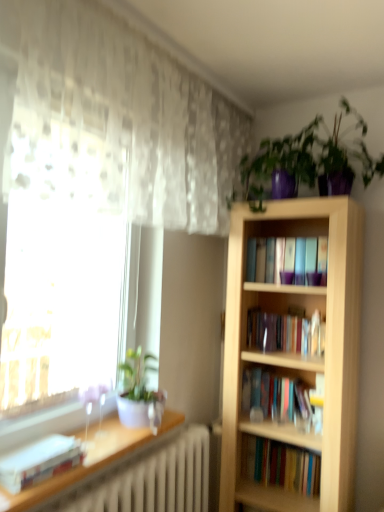
Question: Is shiny purple pot at upper right, the first houseplant viewed from the top, closer to the viewer compared to white glossy pot at left, marked as the 2th houseplant in a right-to-left arrangement?

Choices:
 (A) yes
 (B) no

Answer: (A)

Question: From the image's perspective, is shiny purple pot at upper right, marked as the 1th houseplant in a right-to-left arrangement, located beneath white glossy pot at left, marked as the 1th houseplant in a bottom-to-top arrangement?

Choices:
 (A) yes
 (B) no

Answer: (B)

Question: Is shiny purple pot at upper right, the second houseplant positioned from the left, facing away from white glossy pot at left, marked as the 2th houseplant in a top-to-bottom arrangement?

Choices:
 (A) no
 (B) yes

Answer: (A)

Question: From the image's perspective, is shiny purple pot at upper right, which is counted as the 2th houseplant, starting from the bottom, on white glossy pot at left, marked as the 1th houseplant in a bottom-to-top arrangement?

Choices:
 (A) no
 (B) yes

Answer: (B)

Question: Is shiny purple pot at upper right, the second houseplant positioned from the left, further to the viewer compared to white glossy pot at left, marked as the 2th houseplant in a right-to-left arrangement?

Choices:
 (A) no
 (B) yes

Answer: (A)

Question: In terms of size, does white matte book at lower left appear bigger or smaller than shiny purple pot at upper right, which is counted as the 2th houseplant, starting from the bottom?

Choices:
 (A) small
 (B) big

Answer: (A)

Question: From their relative heights in the image, would you say white matte book at lower left is taller or shorter than shiny purple pot at upper right, which is counted as the 2th houseplant, starting from the bottom?

Choices:
 (A) short
 (B) tall

Answer: (A)

Question: From a real-world perspective, relative to shiny purple pot at upper right, the second houseplant positioned from the left, is white matte book at lower left vertically above or below?

Choices:
 (A) above
 (B) below

Answer: (B)

Question: Is white matte book at lower left inside the boundaries of shiny purple pot at upper right, the second houseplant positioned from the left, or outside?

Choices:
 (A) outside
 (B) inside

Answer: (A)

Question: From a real-world perspective, relative to white matte book at lower left, is white glossy pot at left, which appears as the first houseplant when viewed from the left, vertically above or below?

Choices:
 (A) below
 (B) above

Answer: (B)

Question: Considering their positions, is white glossy pot at left, marked as the 2th houseplant in a right-to-left arrangement, located in front of or behind white matte book at lower left?

Choices:
 (A) behind
 (B) front

Answer: (A)

Question: Is white glossy pot at left, marked as the 2th houseplant in a top-to-bottom arrangement, wider or thinner than white matte book at lower left?

Choices:
 (A) wide
 (B) thin

Answer: (A)

Question: From the image's perspective, relative to white matte book at lower left, is white glossy pot at left, marked as the 1th houseplant in a bottom-to-top arrangement, above or below?

Choices:
 (A) below
 (B) above

Answer: (B)

Question: Is white glossy pot at left, marked as the 2th houseplant in a right-to-left arrangement, to the left or to the right of translucent fabric at left in the image?

Choices:
 (A) left
 (B) right

Answer: (B)

Question: Is white glossy pot at left, marked as the 2th houseplant in a top-to-bottom arrangement, wider or thinner than translucent fabric at left?

Choices:
 (A) thin
 (B) wide

Answer: (B)